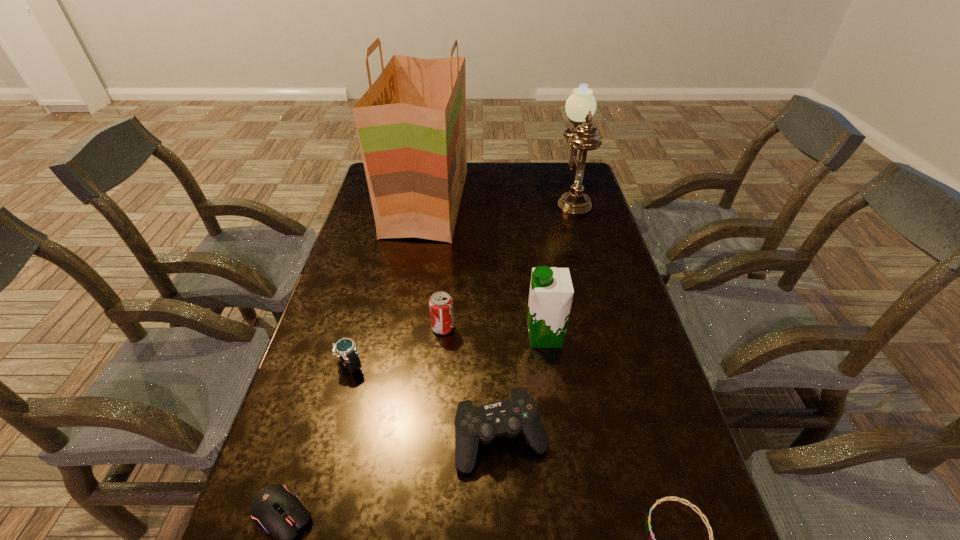
Find the location of a particular element. The image size is (960, 540). the tallest object is located at coordinates (411, 123).

You are a GUI agent. You are given a task and a screenshot of the screen. Output one action in this format:
    pyautogui.click(x=<x>, y=<y>)
    Task: Click on the seventh shortest object
    This screenshot has height=540, width=960.
    Given the screenshot: What is the action you would take?
    pyautogui.click(x=580, y=106)

Find the location of a particular element. soya milk is located at coordinates point(551,292).

The width and height of the screenshot is (960, 540). Find the location of `the fourth tallest object`. the fourth tallest object is located at coordinates (440, 303).

Locate an element on the screen. Image resolution: width=960 pixels, height=540 pixels. the sixth farthest object is located at coordinates (519, 413).

This screenshot has width=960, height=540. What are the coordinates of `the fourth shortest object` in the screenshot? It's located at click(519, 413).

Where is `the fifth farthest object`? The height and width of the screenshot is (540, 960). the fifth farthest object is located at coordinates (344, 348).

Find the location of `watch`. watch is located at coordinates (344, 348).

At what (x,y) coordinates should I click in order to perform the action: click on vacant point located 0.060m on the right of the tallest object. Please return your answer as a coordinate pair (x, y). This screenshot has width=960, height=540. Looking at the image, I should click on (483, 202).

Find the location of a particular element. free location located on the left of the second tallest object is located at coordinates (497, 196).